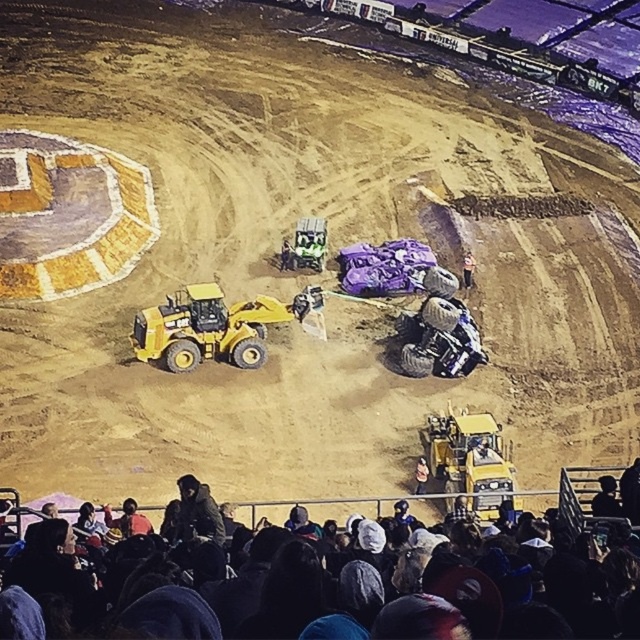
Is yellow rubber monster truck at lower right closer to the viewer compared to dark gray jacket at lower left?

No, it is not.

Is point (500, 492) farther from camera compared to point (209, 502)?

Yes, it is behind point (209, 502).

Where is `yellow rubber monster truck at lower right`? yellow rubber monster truck at lower right is located at coordinates (472, 461).

Between dark clothing crowd at lower center and light brown leather jacket at lower center, which one has less height?

With less height is light brown leather jacket at lower center.

Image resolution: width=640 pixels, height=640 pixels. I want to click on dark clothing crowd at lower center, so click(396, 588).

Locate an element on the screen. Image resolution: width=640 pixels, height=640 pixels. dark clothing crowd at lower center is located at coordinates (x=396, y=588).

Can you confirm if yellow rubber monster truck at lower right is taller than light brown leather jacket at center?

Correct, yellow rubber monster truck at lower right is much taller as light brown leather jacket at center.

Is yellow rubber monster truck at lower right positioned in front of light brown leather jacket at center?

That is True.

Who is more forward, (464,408) or (464,268)?

Positioned in front is point (464,408).

Locate an element on the screen. Image resolution: width=640 pixels, height=640 pixels. yellow rubber monster truck at lower right is located at coordinates (472, 461).